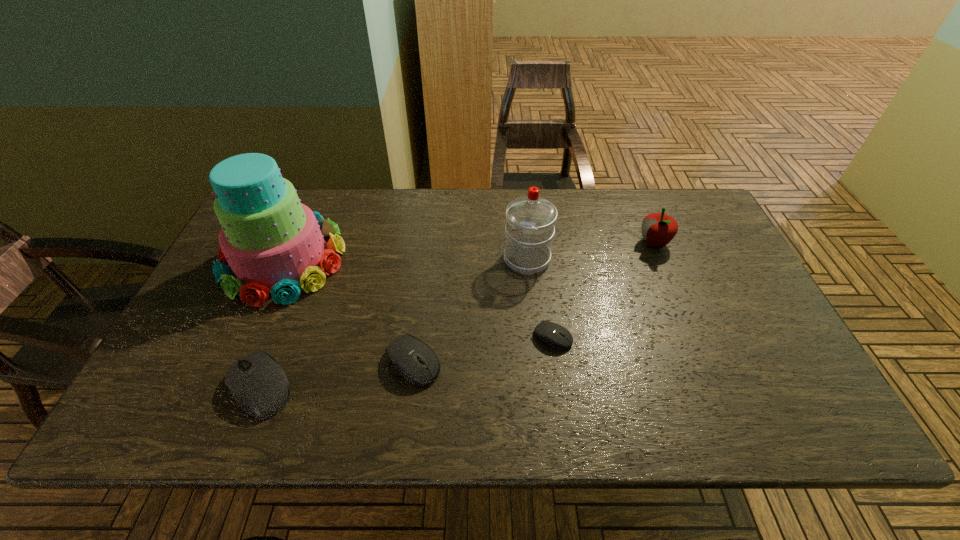
The width and height of the screenshot is (960, 540). What are the coordinates of `free space located on the back of the second computer equipment from left to right` in the screenshot? It's located at (428, 244).

I want to click on vacant space situated on the back of the shortest object, so click(x=538, y=228).

This screenshot has height=540, width=960. In order to click on free space located on the handle side of the fifth shortest object in this screenshot , I will do `click(522, 218)`.

Identify the location of vacant region located 0.100m on the handle side of the fifth shortest object. (523, 222).

Identify the location of blank space located on the handle side of the fifth shortest object. (521, 205).

Locate an element on the screen. blank area located on the right of the cake is located at coordinates (428, 260).

Identify the location of free location located on the right of the rightmost object. This screenshot has height=540, width=960. (694, 243).

You are a GUI agent. You are given a task and a screenshot of the screen. Output one action in this format:
    pyautogui.click(x=<x>, y=<y>)
    Task: Click on the cake that is at the far edge
    
    Given the screenshot: What is the action you would take?
    click(273, 244)

Where is `apple that is at the far edge`? apple that is at the far edge is located at coordinates (658, 229).

You are a GUI agent. You are given a task and a screenshot of the screen. Output one action in this format:
    pyautogui.click(x=<x>, y=<y>)
    Task: Click on the object situated at the left edge
    The image size is (960, 540).
    Given the screenshot: What is the action you would take?
    pyautogui.click(x=273, y=244)